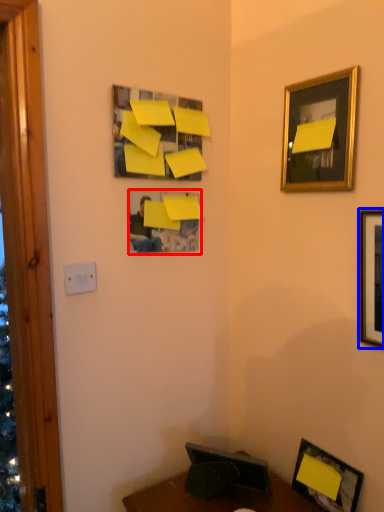
Question: Which object is closer to the camera taking this photo, picture frame (highlighted by a red box) or picture frame (highlighted by a blue box)?

Choices:
 (A) picture frame
 (B) picture frame

Answer: (B)